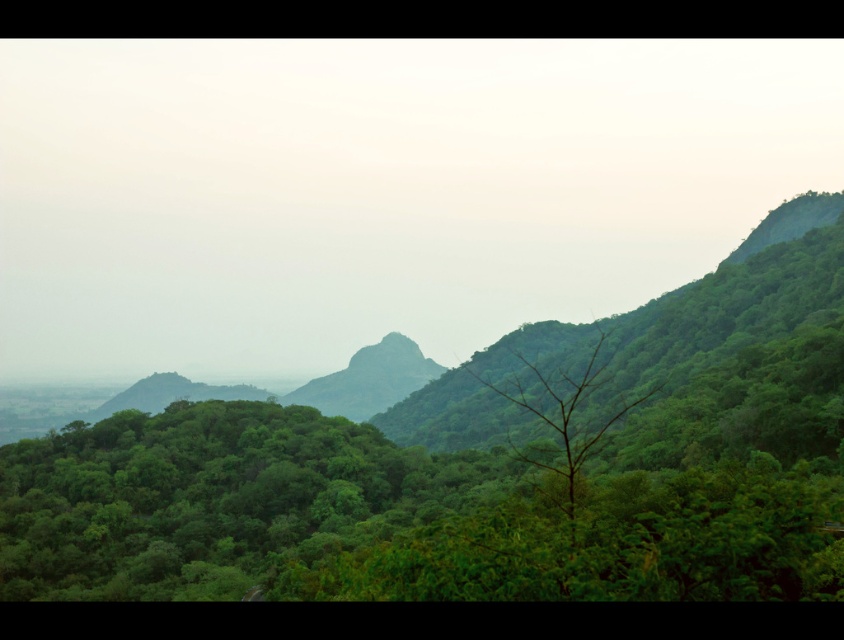
Is point (567, 406) behind point (388, 378)?

No.

Measure the distance between green leafy tree at center and camera.

A distance of 8.45 meters exists between green leafy tree at center and camera.

Which is in front, point (604, 332) or point (417, 356)?

Point (417, 356) is in front.

Locate an element on the screen. The height and width of the screenshot is (640, 844). green leafy tree at center is located at coordinates (565, 420).